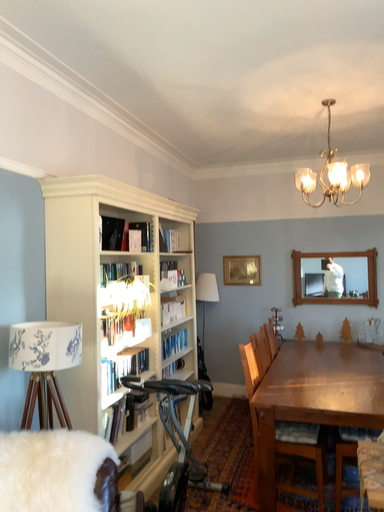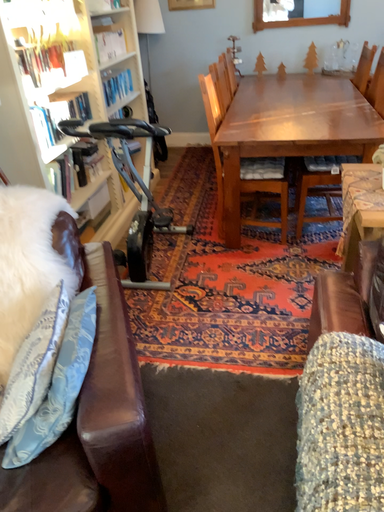
Question: How did the camera likely rotate when shooting the video?

Choices:
 (A) rotated downward
 (B) rotated upward

Answer: (A)